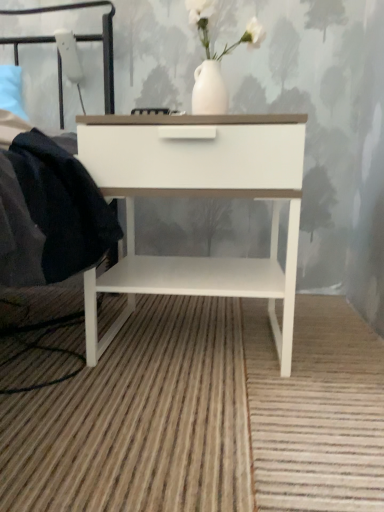
Question: Is black metal headboard at upper left to the left or to the right of white glossy nightstand at center in the image?

Choices:
 (A) right
 (B) left

Answer: (B)

Question: Is point (31, 39) positioned closer to the camera than point (129, 241)?

Choices:
 (A) closer
 (B) farther

Answer: (B)

Question: Is black metal headboard at upper left wider or thinner than white glossy nightstand at center?

Choices:
 (A) wide
 (B) thin

Answer: (A)

Question: Is point (296, 151) positioned closer to the camera than point (57, 77)?

Choices:
 (A) closer
 (B) farther

Answer: (A)

Question: Considering the positions of white glossy nightstand at center and black metal headboard at upper left in the image, is white glossy nightstand at center wider or thinner than black metal headboard at upper left?

Choices:
 (A) thin
 (B) wide

Answer: (A)

Question: From the image's perspective, relative to black metal headboard at upper left, is white glossy nightstand at center above or below?

Choices:
 (A) above
 (B) below

Answer: (B)

Question: Is white glossy nightstand at center bigger or smaller than black metal headboard at upper left?

Choices:
 (A) small
 (B) big

Answer: (B)